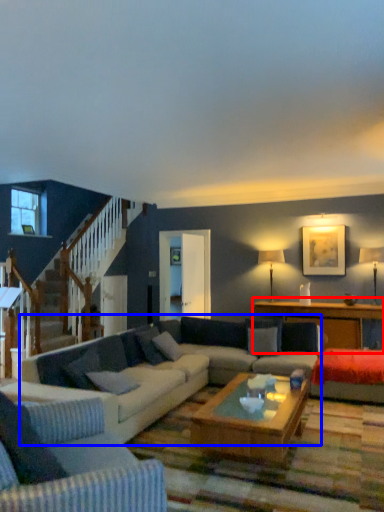
Question: Which point is closer to the camera, table (highlighted by a red box) or studio couch (highlighted by a blue box)?

Choices:
 (A) table
 (B) studio couch

Answer: (B)